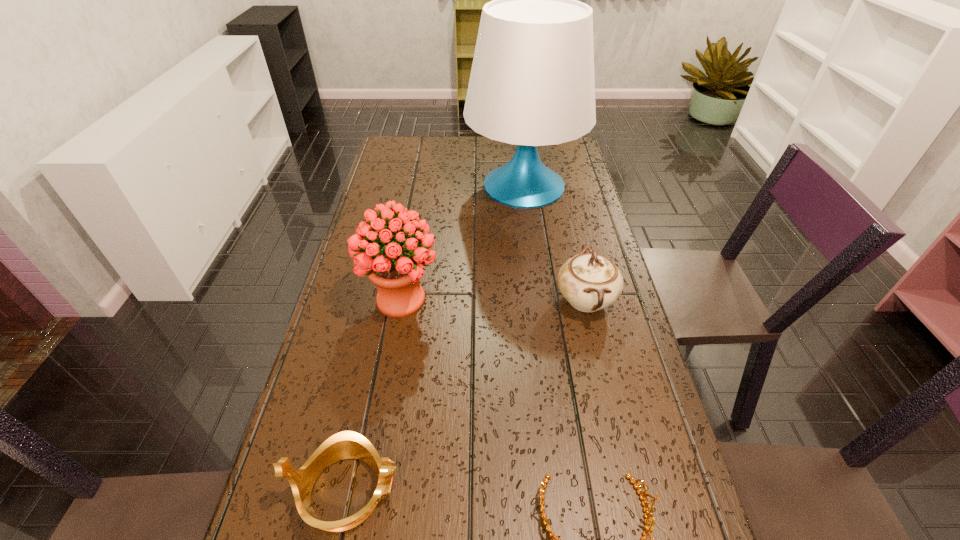
Find the location of a particular element. table lamp is located at coordinates (532, 83).

This screenshot has height=540, width=960. I want to click on the farthest object, so click(532, 83).

You are a GUI agent. You are given a task and a screenshot of the screen. Output one action in this format:
    pyautogui.click(x=<x>, y=<y>)
    Task: Click on the bouquet
    The height and width of the screenshot is (540, 960).
    Given the screenshot: What is the action you would take?
    pyautogui.click(x=396, y=269)

Where is `the third shortest object`? This screenshot has width=960, height=540. the third shortest object is located at coordinates (590, 282).

I want to click on vacant area situated 0.200m on the front-facing side of the table lamp, so click(x=408, y=186).

I want to click on vacant space located 0.100m on the front-facing side of the table lamp, so click(437, 186).

The width and height of the screenshot is (960, 540). What are the coordinates of `free space located 0.220m on the front-facing side of the table lamp` in the screenshot? It's located at (402, 186).

You are a GUI agent. You are given a task and a screenshot of the screen. Output one action in this format:
    pyautogui.click(x=<x>, y=<y>)
    Task: Click on the free space located 0.190m on the front of the fourth shortest object
    
    Given the screenshot: What is the action you would take?
    pyautogui.click(x=384, y=397)

In order to click on free space located on the back of the chinaware in this screenshot , I will do `click(567, 222)`.

You are a GUI agent. You are given a task and a screenshot of the screen. Output one action in this format:
    pyautogui.click(x=<x>, y=<y>)
    Task: Click on the object that is at the far edge
    This screenshot has height=540, width=960.
    Given the screenshot: What is the action you would take?
    pyautogui.click(x=532, y=83)